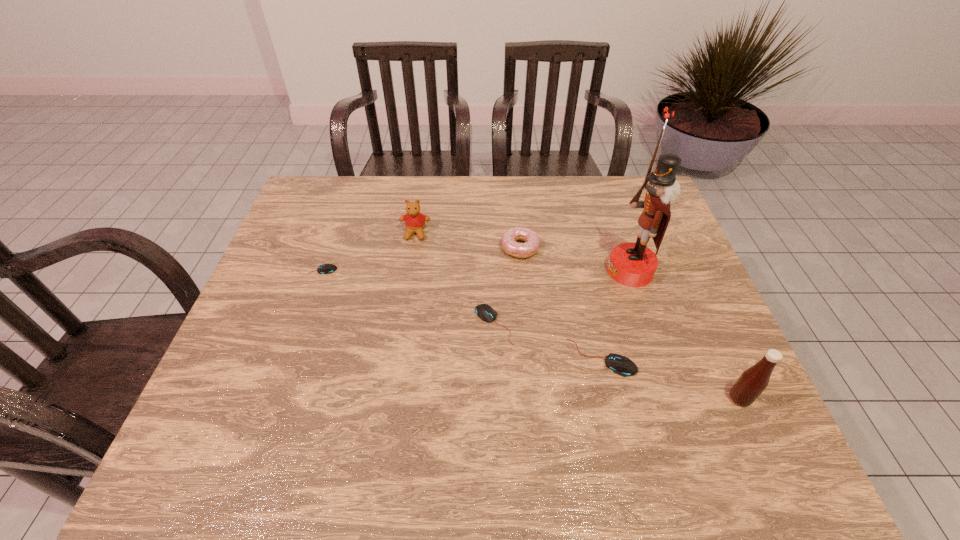
The height and width of the screenshot is (540, 960). In order to click on object at the near edge in this screenshot , I will do `click(753, 381)`.

The width and height of the screenshot is (960, 540). I want to click on object at the left edge, so (324, 268).

Find the location of `nutcracker that is at the right edge`. nutcracker that is at the right edge is located at coordinates (631, 264).

Locate an element on the screen. The height and width of the screenshot is (540, 960). Tabasco sauce that is at the right edge is located at coordinates (753, 381).

Locate an element on the screen. object at the near right corner is located at coordinates (753, 381).

The image size is (960, 540). In order to click on vacant region at the far edge of the desktop in this screenshot , I will do `click(510, 198)`.

This screenshot has height=540, width=960. I want to click on free space at the near edge of the desktop, so click(x=412, y=396).

In the image, there is a desktop. Where is `vacant area at the left edge`? The height and width of the screenshot is (540, 960). vacant area at the left edge is located at coordinates (294, 323).

Identify the location of blank space at the right edge of the desktop. The height and width of the screenshot is (540, 960). (634, 225).

Where is `free space at the far left corner`? The image size is (960, 540). free space at the far left corner is located at coordinates (348, 188).